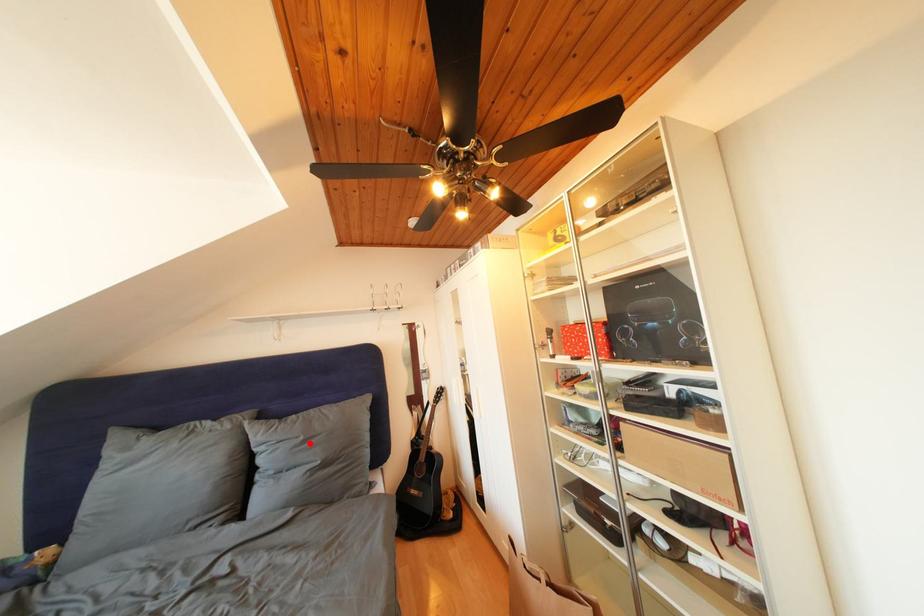
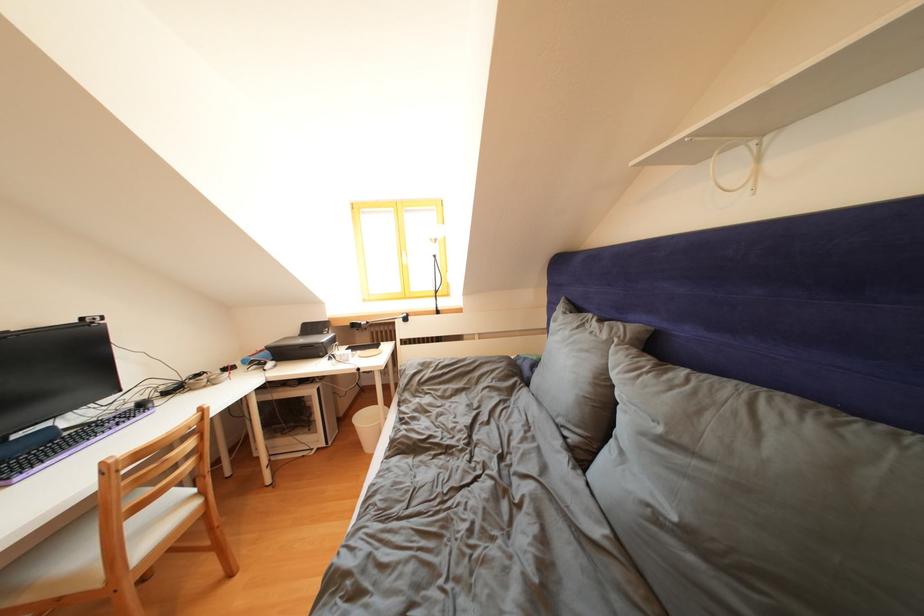
Find the pixel in the second image that matches the highlighted location in the first image.

(667, 435)